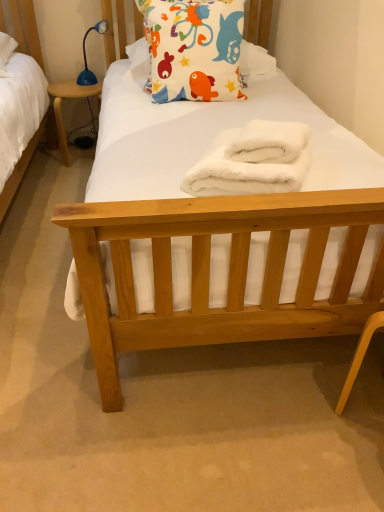
Question: Is white fabric pillow with colorful fish designs at upper center shorter than white fluffy towel at center?

Choices:
 (A) no
 (B) yes

Answer: (A)

Question: From a real-world perspective, is white fabric pillow with colorful fish designs at upper center located beneath white fluffy towel at center?

Choices:
 (A) yes
 (B) no

Answer: (B)

Question: Is white fabric pillow with colorful fish designs at upper center facing away from white fluffy towel at center?

Choices:
 (A) no
 (B) yes

Answer: (A)

Question: Considering the relative positions of white fabric pillow with colorful fish designs at upper center and white fluffy towel at center in the image provided, is white fabric pillow with colorful fish designs at upper center in front of white fluffy towel at center?

Choices:
 (A) yes
 (B) no

Answer: (B)

Question: From the image's perspective, would you say white fabric pillow with colorful fish designs at upper center is positioned over white fluffy towel at center?

Choices:
 (A) yes
 (B) no

Answer: (A)

Question: Is the surface of white fabric pillow with colorful fish designs at upper center in direct contact with white fluffy towel at center?

Choices:
 (A) yes
 (B) no

Answer: (B)

Question: Is blue plastic desk at left smaller than blue plastic lamp at upper left?

Choices:
 (A) yes
 (B) no

Answer: (B)

Question: Considering the relative sizes of blue plastic desk at left and blue plastic lamp at upper left in the image provided, is blue plastic desk at left taller than blue plastic lamp at upper left?

Choices:
 (A) yes
 (B) no

Answer: (A)

Question: Is blue plastic desk at left positioned in front of blue plastic lamp at upper left?

Choices:
 (A) yes
 (B) no

Answer: (B)

Question: Could you tell me if blue plastic desk at left is turned towards blue plastic lamp at upper left?

Choices:
 (A) no
 (B) yes

Answer: (A)

Question: From the image's perspective, is blue plastic desk at left below blue plastic lamp at upper left?

Choices:
 (A) yes
 (B) no

Answer: (A)

Question: Is blue plastic desk at left in contact with blue plastic lamp at upper left?

Choices:
 (A) yes
 (B) no

Answer: (B)

Question: Is white fluffy towel at center next to blue plastic desk at left and touching it?

Choices:
 (A) yes
 (B) no

Answer: (B)